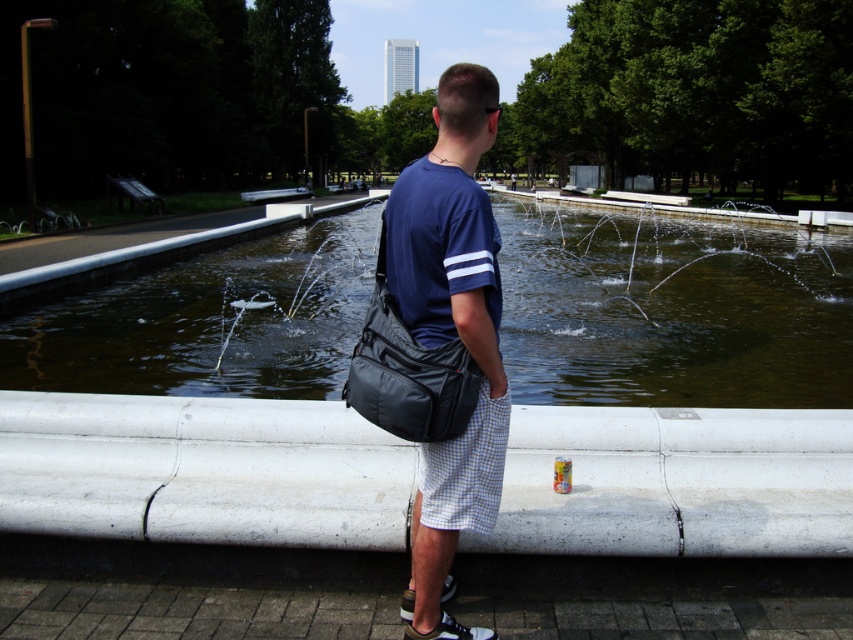
You are a photographer trying to capture the clear water at center without any obstructions. The black fabric bag at center is in your way. Can you move the bag to the side to get a clear shot?

The black fabric bag at center is behind clear water at center, so moving it to the side would not obstruct the shot since it is already positioned behind the water.

Based on the scene description, can you determine if the clear water at center is above or below the matte black bag at center?

The clear water at center is positioned over the matte black bag at center, meaning it is above the matte black bag at center.